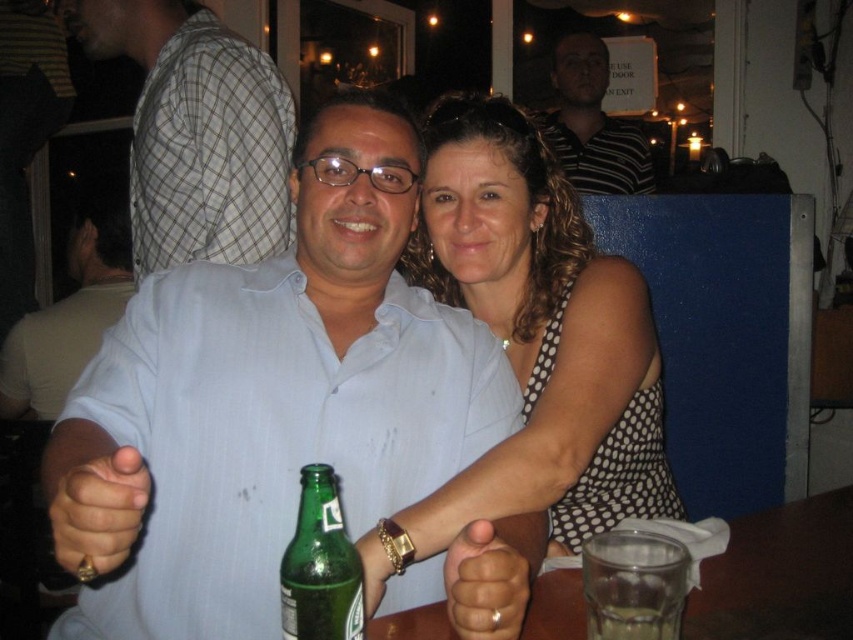
You are a photographer trying to capture a closeup of the green glass bottle at center. However, the white checkered shirt at upper left is blocking your view. Can you estimate if the shirt is wider than the bottle?

The white checkered shirt at upper left might be wider than green glass bottle at center, so there is a possibility that the shirt is blocking the view of the bottle.

You are standing in the room and see the point at coordinates (196,132). What object is this point located on?

The point at coordinates (196,132) is located on the white checkered shirt at upper left.